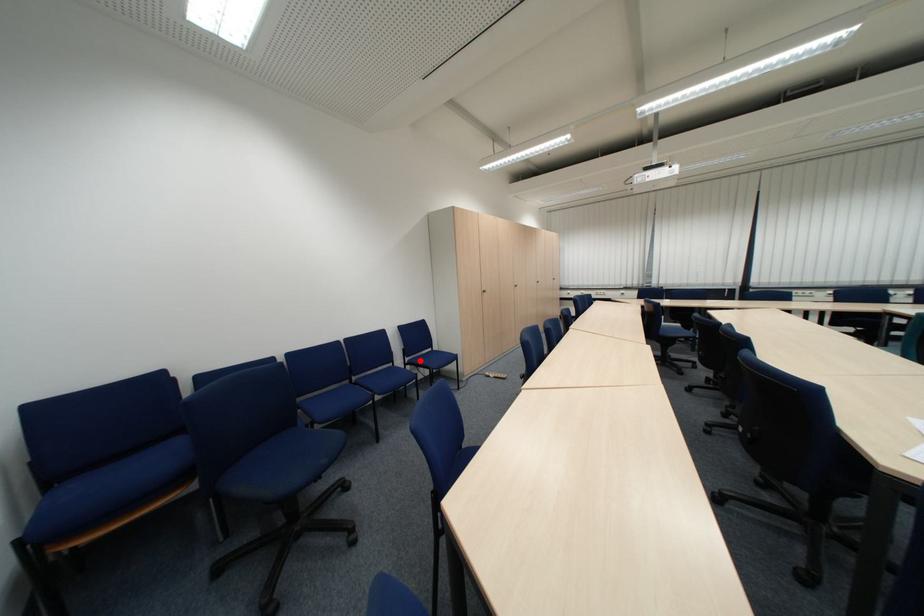
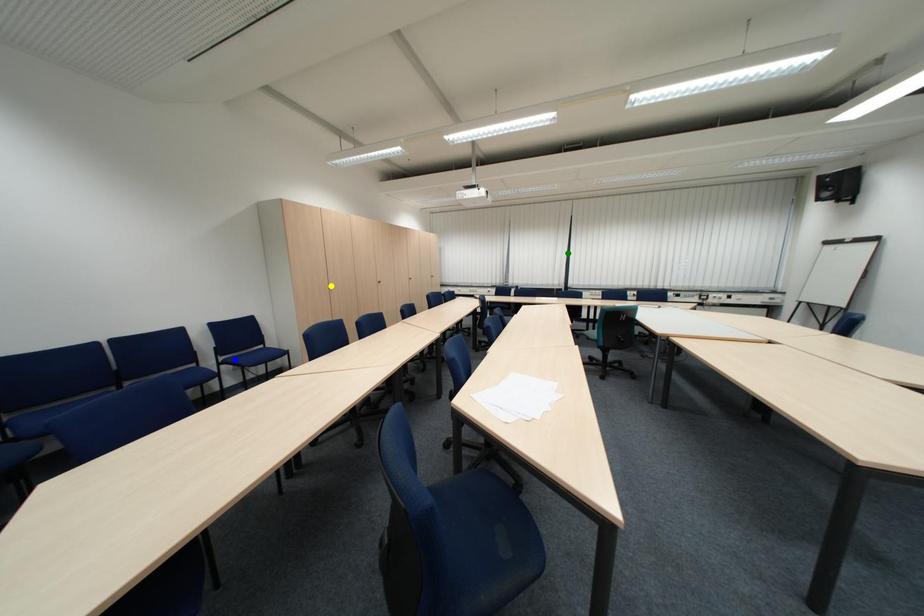
Question: I am providing you with two images of the same scene from different viewpoints. A red point is marked on the first image. You are given multiple points on the second image. Which mark in image 2 goes with the point in image 1?

Choices:
 (A) blue point
 (B) yellow point
 (C) green point

Answer: (A)